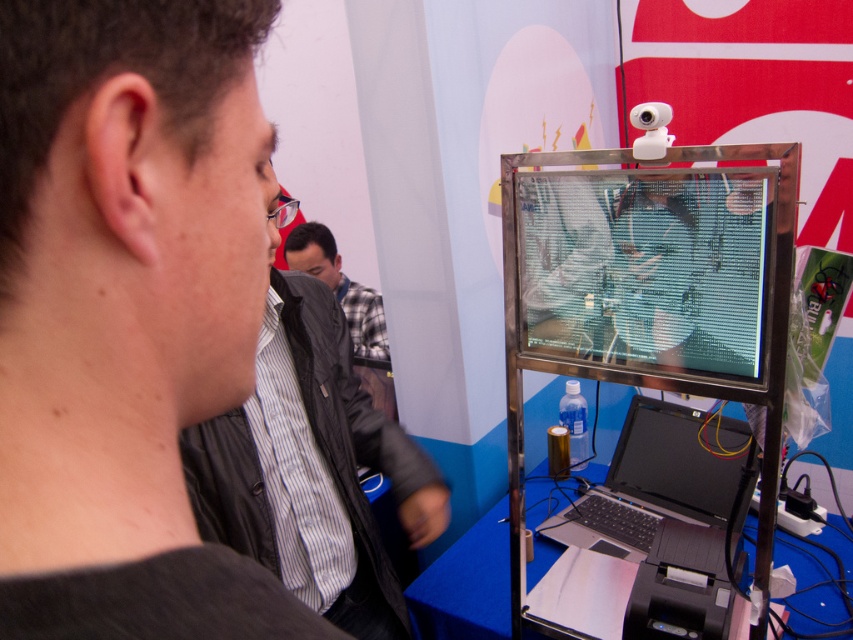
You are at the tech event and want to take a photo of the display setup. There is a black matte jacket at upper left in your view. Where should you position yourself to ensure the jacket is not blocking the display?

The black matte jacket at upper left is located at point (126,312), so you should position yourself to the lower right of that coordinate to avoid the jacket blocking the display.

You are attending a tech exhibition and notice the black matte jacket at upper left and the transparent plastic screen at center. Which object is located lower in the image?

The black matte jacket at upper left is positioned under the transparent plastic screen at center, so it is located lower in the image.